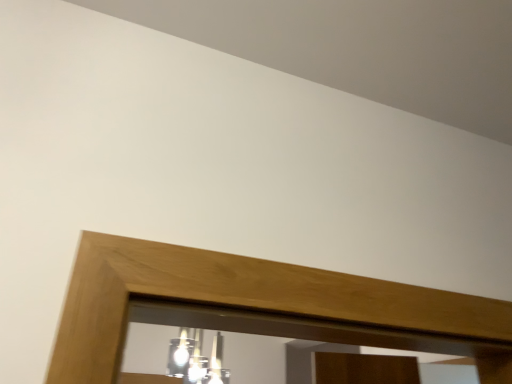
This screenshot has height=384, width=512. What do you see at coordinates (196, 359) in the screenshot?
I see `matte glass light fixture at center` at bounding box center [196, 359].

Identify the location of matte glass light fixture at center. (196, 359).

Consider the image. What is the approximate height of matte glass light fixture at center?

matte glass light fixture at center is 13.60 inches in height.

Where is `matte glass light fixture at center`? matte glass light fixture at center is located at coordinates (196, 359).